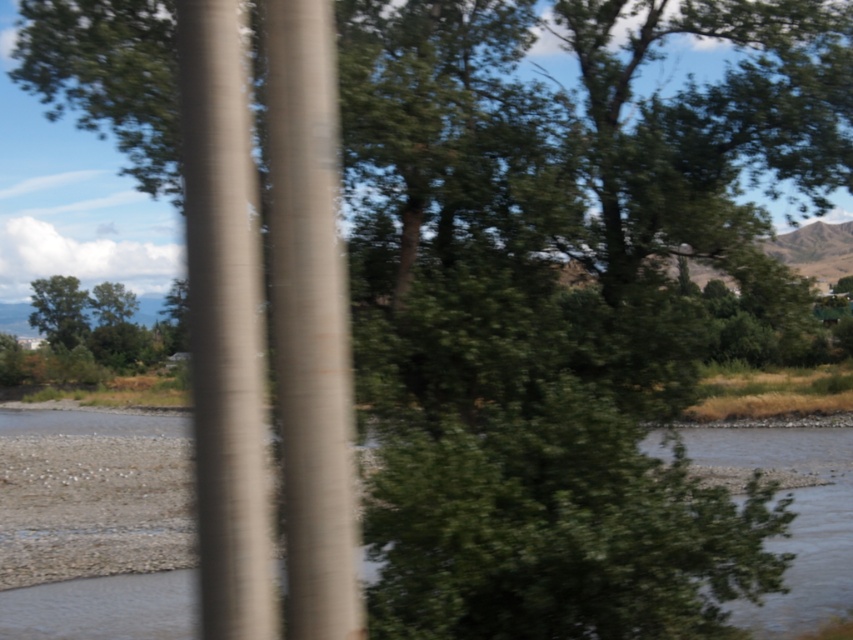
Question: Is the position of smooth concrete pole at center less distant than that of smooth brown pole at center?

Choices:
 (A) yes
 (B) no

Answer: (B)

Question: Which point is closer to the camera taking this photo?

Choices:
 (A) (321, 372)
 (B) (227, 156)

Answer: (B)

Question: Is smooth concrete pole at center further to the viewer compared to green leafy tree at left?

Choices:
 (A) no
 (B) yes

Answer: (A)

Question: Which object appears farthest from the camera in this image?

Choices:
 (A) smooth brown pole at center
 (B) green leafy tree at left
 (C) smooth concrete pole at center

Answer: (B)

Question: Which of the following is the closest to the observer?

Choices:
 (A) green leafy tree at left
 (B) smooth brown pole at center

Answer: (B)

Question: Is smooth brown pole at center positioned behind green leafy tree at left?

Choices:
 (A) no
 (B) yes

Answer: (A)